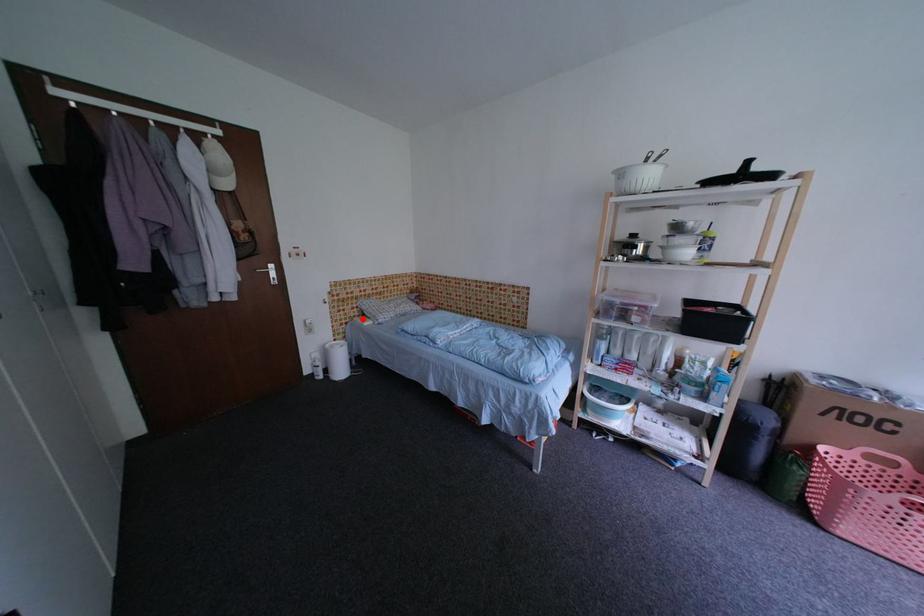
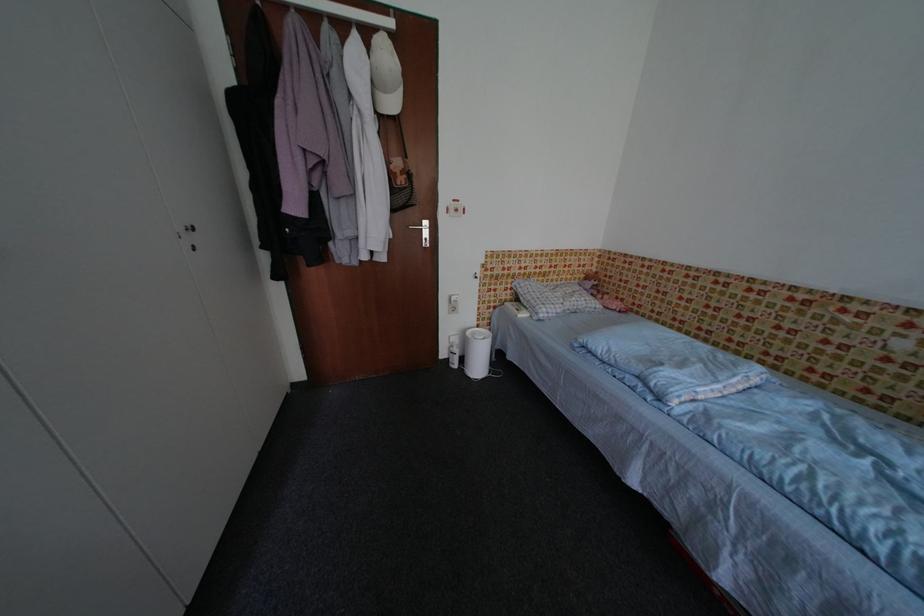
In the second image, find the point that corresponds to the highlighted location in the first image.

(514, 302)